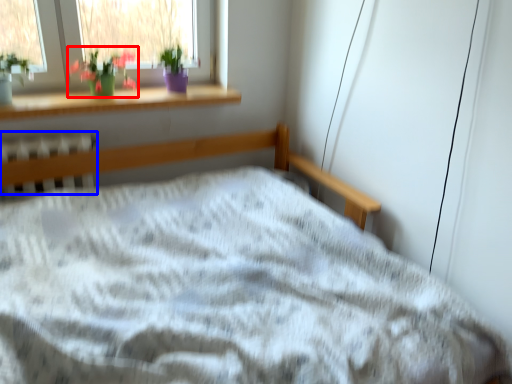
Question: Which object is further to the camera taking this photo, floral arrangement (highlighted by a red box) or radiator (highlighted by a blue box)?

Choices:
 (A) floral arrangement
 (B) radiator

Answer: (A)